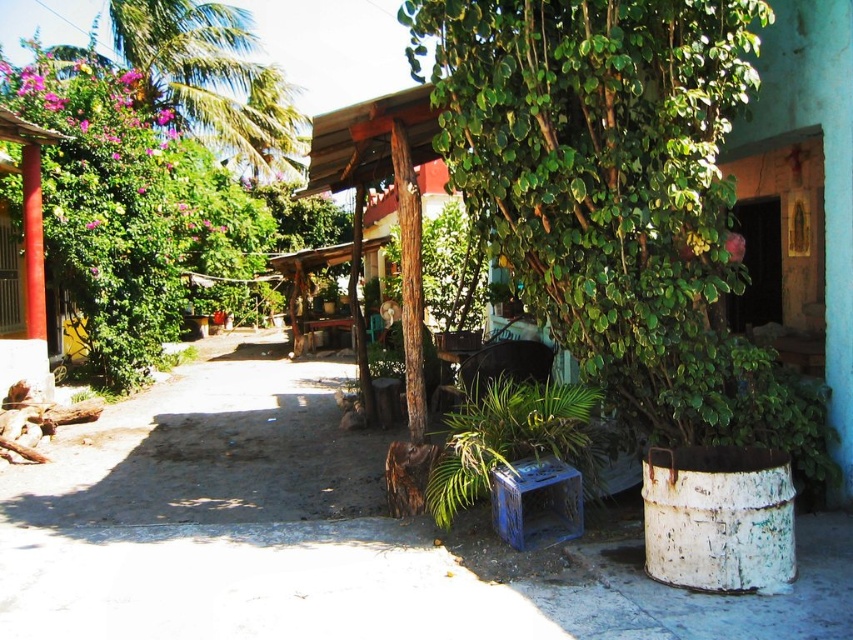
You are a painter setting up your easel in this rustic outdoor scene. You want to paint the green leafy palm tree at upper left and the smooth red column at left. Which object should you position closer to the center of your canvas to ensure both fit within the frame?

The smooth red column at left is narrower than the green leafy palm tree at upper left, so positioning the palm tree at upper left closer to the center would allow both to fit within the frame.

You are a delivery person trying to navigate through the rustic concrete alley at center. There is a smooth red column at left nearby. Since you need to pass through the alley, can you estimate whether the alley is wider than the column?

The rustic concrete alley at center has a larger size compared to smooth red column at left, so the alley is wider than the column, allowing passage.

You are a painter standing at the entrance of the rustic concrete alley at center. You want to paint the green leafy palm tree at upper left. Can you see the top of the palm tree from your current position?

The rustic concrete alley at center is not as tall as green leafy palm tree at upper left, so yes, you can see the top of the palm tree at upper left from your current position.